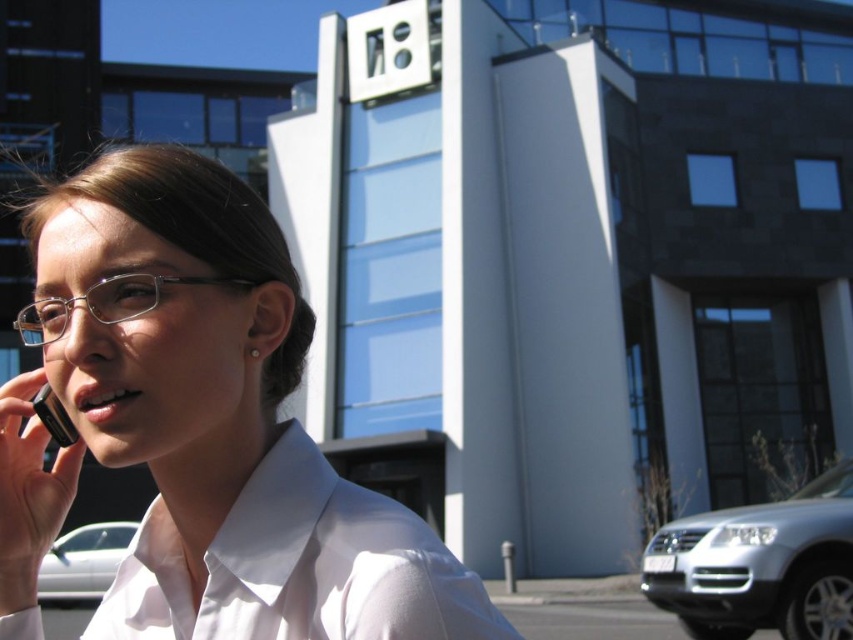
Question: Which of the following is the farthest from the observer?

Choices:
 (A) white glossy shirt at center
 (B) white glossy car at lower left

Answer: (B)

Question: Which object appears closest to the camera in this image?

Choices:
 (A) white smooth shirt at center
 (B) white glossy car at lower left
 (C) white glossy shirt at center
 (D) silver metallic suv at lower right

Answer: (A)

Question: Can you confirm if white smooth shirt at center is wider than black glossy smartphone at left?

Choices:
 (A) yes
 (B) no

Answer: (A)

Question: Is white smooth shirt at center bigger than black glossy smartphone at left?

Choices:
 (A) no
 (B) yes

Answer: (B)

Question: Among these points, which one is nearest to the camera?

Choices:
 (A) (90, 625)
 (B) (71, 561)
 (C) (824, 611)

Answer: (A)

Question: Can you confirm if silver metallic suv at lower right is wider than white glossy car at lower left?

Choices:
 (A) no
 (B) yes

Answer: (A)